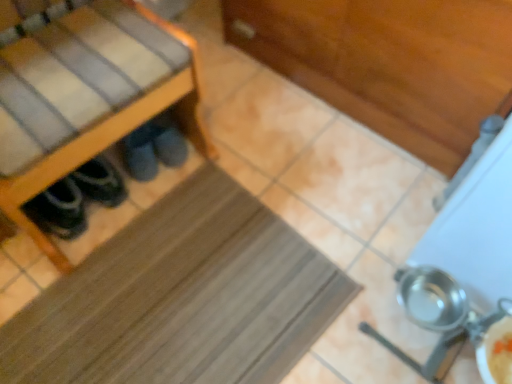
Locate an element on the screen. The image size is (512, 384). blank space situated above brown rubber mat at center (from a real-world perspective) is located at coordinates (184, 303).